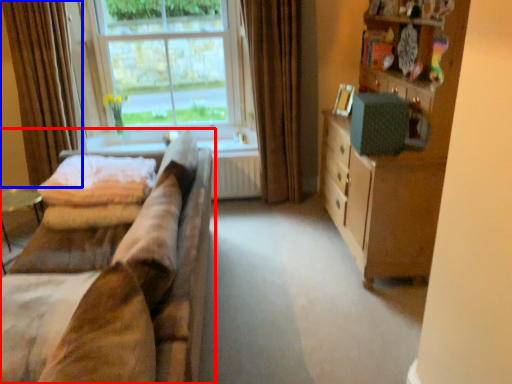
Question: Which of the following is the closest to the observer, studio couch (highlighted by a red box) or curtain (highlighted by a blue box)?

Choices:
 (A) studio couch
 (B) curtain

Answer: (A)